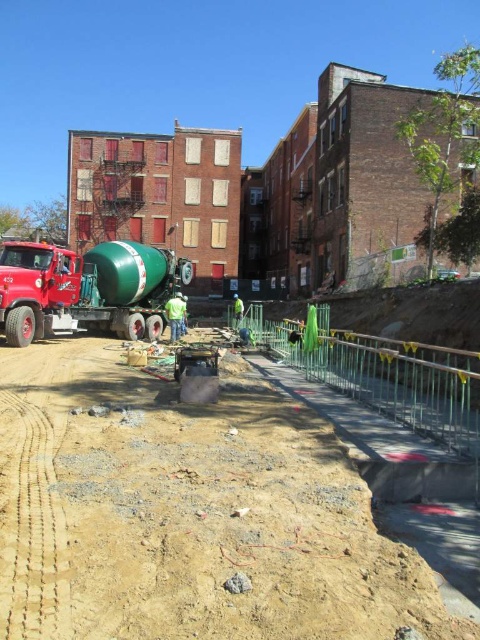
Is brown sandy dirt track at lower center shorter than green matte trailer truck at center?

Correct, brown sandy dirt track at lower center is not as tall as green matte trailer truck at center.

Is point (338, 564) positioned after point (119, 275)?

No, it is in front of (119, 275).

Identify the location of brown sandy dirt track at lower center. This screenshot has width=480, height=640. (187, 513).

Is brown sandy dirt track at lower center shorter than green fabric construction worker at center?

Yes.

Can you confirm if brown sandy dirt track at lower center is thinner than green fabric construction worker at center?

Incorrect, brown sandy dirt track at lower center's width is not less than green fabric construction worker at center's.

Who is more forward, (70, 349) or (168, 307)?

Point (70, 349)

Locate an element on the screen. Image resolution: width=480 pixels, height=640 pixels. brown sandy dirt track at lower center is located at coordinates (187, 513).

Which is behind, point (22, 314) or point (168, 298)?

The point (168, 298) is behind.

Can you confirm if green matte trailer truck at center is positioned below green fabric construction worker at center?

Actually, green matte trailer truck at center is above green fabric construction worker at center.

Locate an element on the screen. green matte trailer truck at center is located at coordinates (86, 289).

Locate an element on the screen. This screenshot has width=480, height=640. green matte trailer truck at center is located at coordinates pyautogui.click(x=86, y=289).